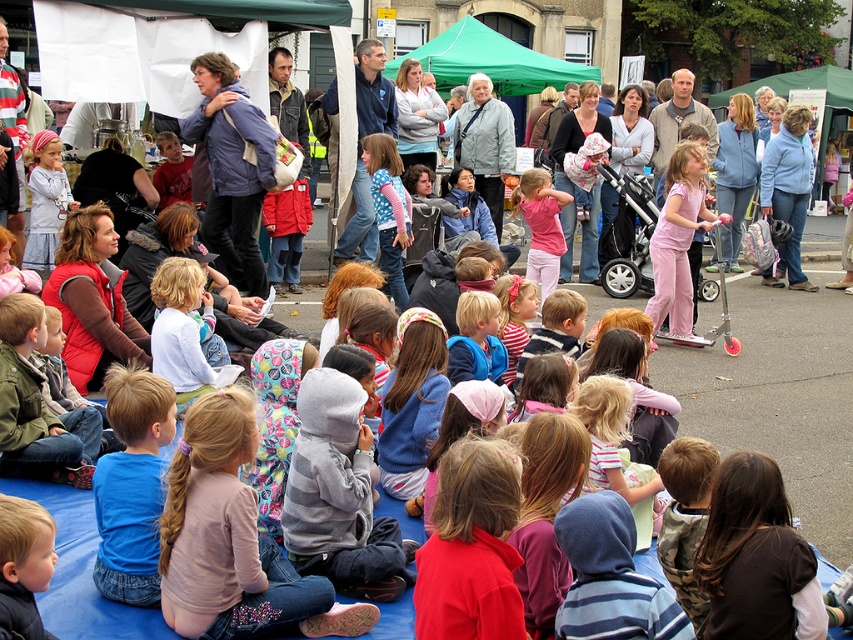
In the scene shown: Is green fabric canopy at upper center bigger than pink cotton pants at center?

Correct, green fabric canopy at upper center is larger in size than pink cotton pants at center.

How distant is green fabric canopy at upper center from pink cotton pants at center?

green fabric canopy at upper center and pink cotton pants at center are 12.60 meters apart.

Does point (590, 65) lie in front of point (700, 172)?

No, it is behind (700, 172).

I want to click on green fabric canopy at upper center, so click(x=491, y=60).

Between green fabric canopy at upper center and light blue fabric at center, which one is positioned higher?

Positioned higher is green fabric canopy at upper center.

Between point (532, 88) and point (170, 266), which one is positioned behind?

Point (532, 88)

This screenshot has height=640, width=853. Find the location of `green fabric canopy at upper center`. green fabric canopy at upper center is located at coordinates (491, 60).

Is pink cotton pants at center to the right of light blue fabric at center from the viewer's perspective?

Correct, you'll find pink cotton pants at center to the right of light blue fabric at center.

Locate an element on the screen. The height and width of the screenshot is (640, 853). pink cotton pants at center is located at coordinates (677, 241).